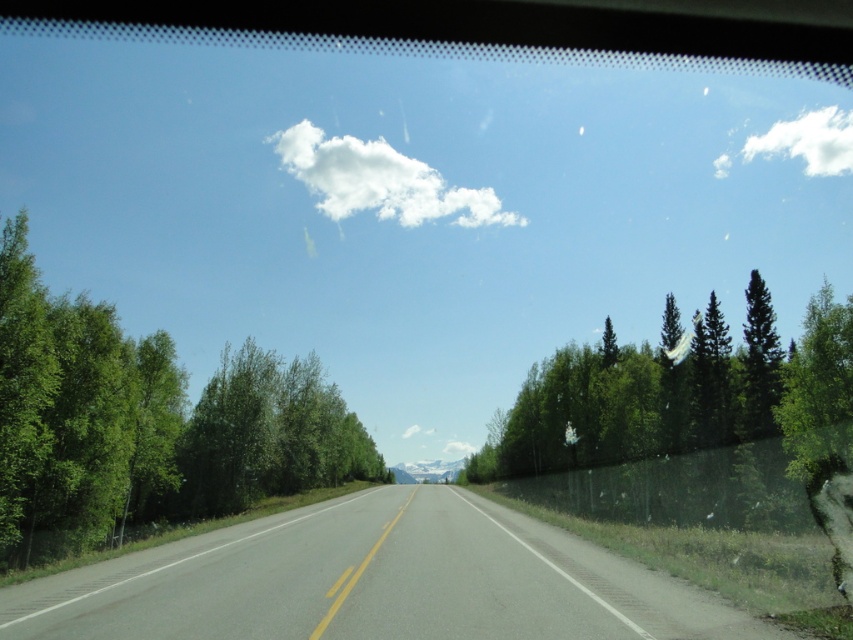
Does green matte trees at right have a larger size compared to white fluffy cloud at upper center?

Yes.

In order to click on green matte trees at right in this screenshot , I will do click(680, 394).

Which is more to the left, green leafy tree at left or white fluffy cloud at upper center?

From the viewer's perspective, green leafy tree at left appears more on the left side.

Between green leafy tree at left and white fluffy cloud at upper center, which one has less height?

Standing shorter between the two is white fluffy cloud at upper center.

Measure the distance between green leafy tree at left and camera.

green leafy tree at left is 77.39 feet away from camera.

This screenshot has height=640, width=853. What are the coordinates of `green leafy tree at left` in the screenshot? It's located at (144, 424).

Looking at this image, who is more forward, (590, 625) or (415, 205)?

Point (590, 625)

Is point (581, 552) farther from viewer compared to point (334, 170)?

No, (581, 552) is closer to viewer.

At what (x,y) coordinates should I click in order to perform the action: click on asphalt road at center. Please return your answer as a coordinate pair (x, y). Looking at the image, I should click on (375, 580).